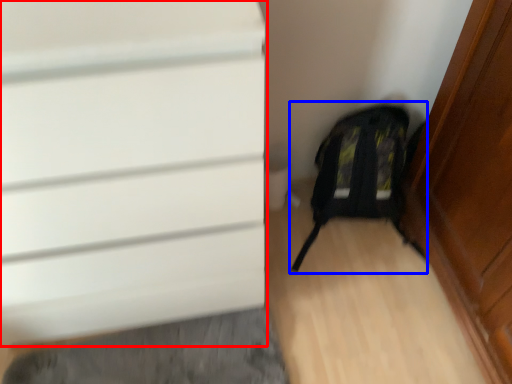
Question: Which object appears farthest to the camera in this image, door (highlighted by a red box) or backpack (highlighted by a blue box)?

Choices:
 (A) door
 (B) backpack

Answer: (B)